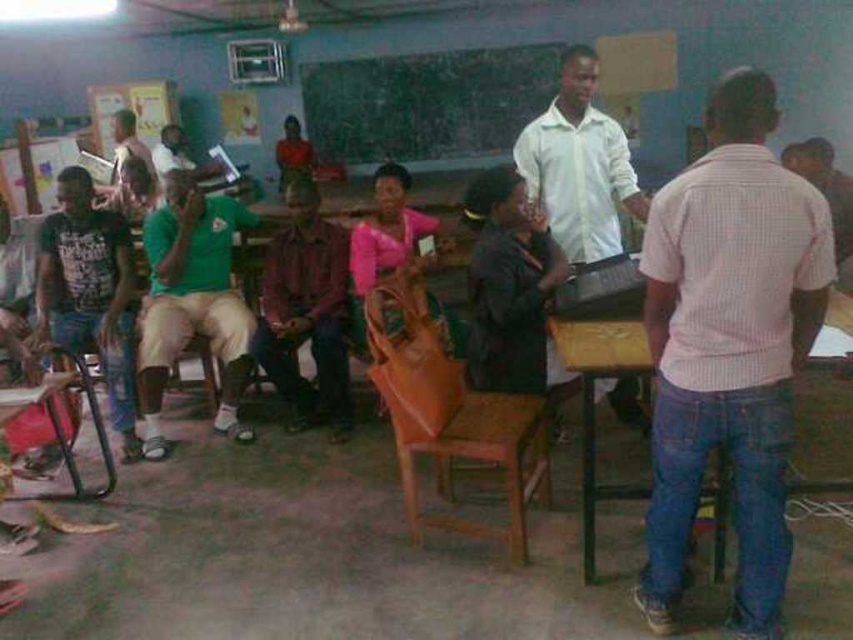
Is white matte shirt at center bigger than dark blue jeans at left?

Correct, white matte shirt at center is larger in size than dark blue jeans at left.

From the picture: Which is above, white matte shirt at center or dark blue jeans at left?

Positioned higher is white matte shirt at center.

Image resolution: width=853 pixels, height=640 pixels. I want to click on white matte shirt at center, so click(579, 164).

Identify the location of white matte shirt at center. (579, 164).

Can you confirm if green chalkboard at upper center is positioned to the right of brown woven chair at center?

Incorrect, green chalkboard at upper center is not on the right side of brown woven chair at center.

Looking at this image, between green chalkboard at upper center and brown woven chair at center, which one is positioned lower?

Positioned lower is brown woven chair at center.

Locate an element on the screen. The height and width of the screenshot is (640, 853). green chalkboard at upper center is located at coordinates (425, 102).

The width and height of the screenshot is (853, 640). Identify the location of green chalkboard at upper center. (425, 102).

Does point (120, 252) lie behind point (90, 396)?

Yes, it is behind point (90, 396).

Can you confirm if dark blue jeans at left is smaller than metallic brown chair at lower left?

No.

Is point (86, 349) farther from viewer compared to point (86, 397)?

Yes.

The width and height of the screenshot is (853, 640). I want to click on dark blue jeans at left, so click(x=90, y=292).